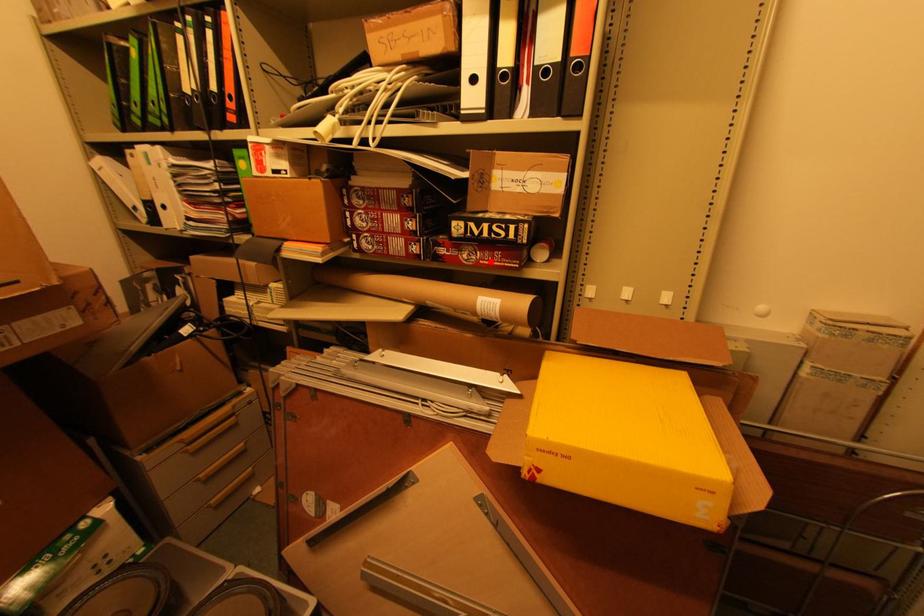
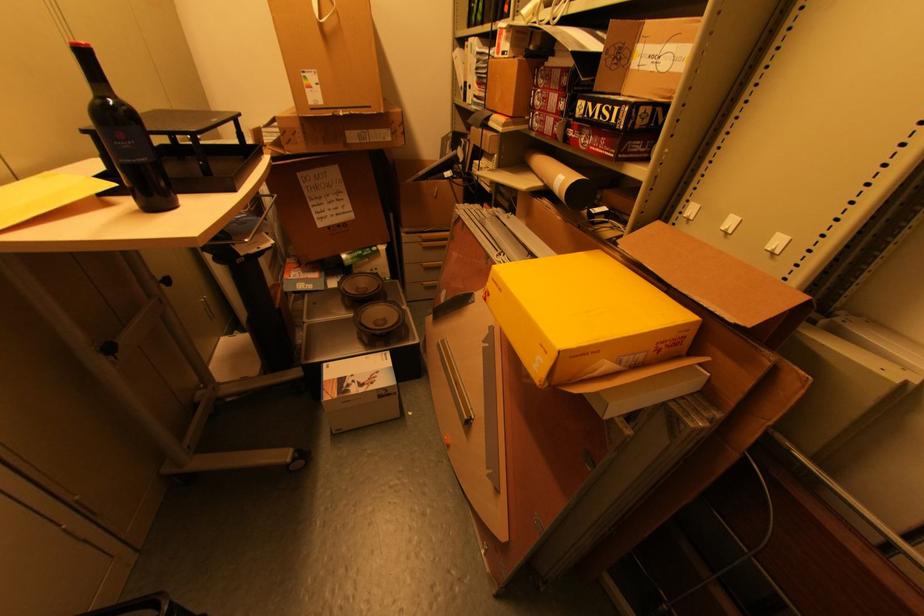
Find the pixel in the second image that matches the highlighted location in the first image.

(599, 148)